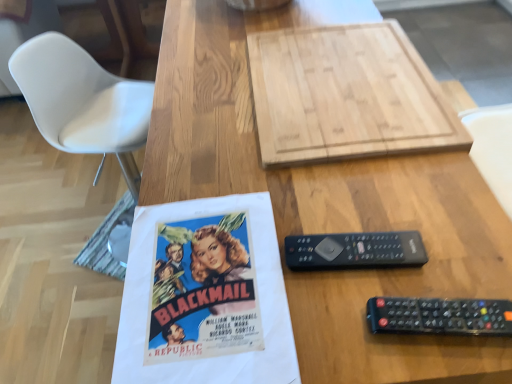
Where is `vacant region in front of black plastic remote at right`? This screenshot has width=512, height=384. vacant region in front of black plastic remote at right is located at coordinates (356, 338).